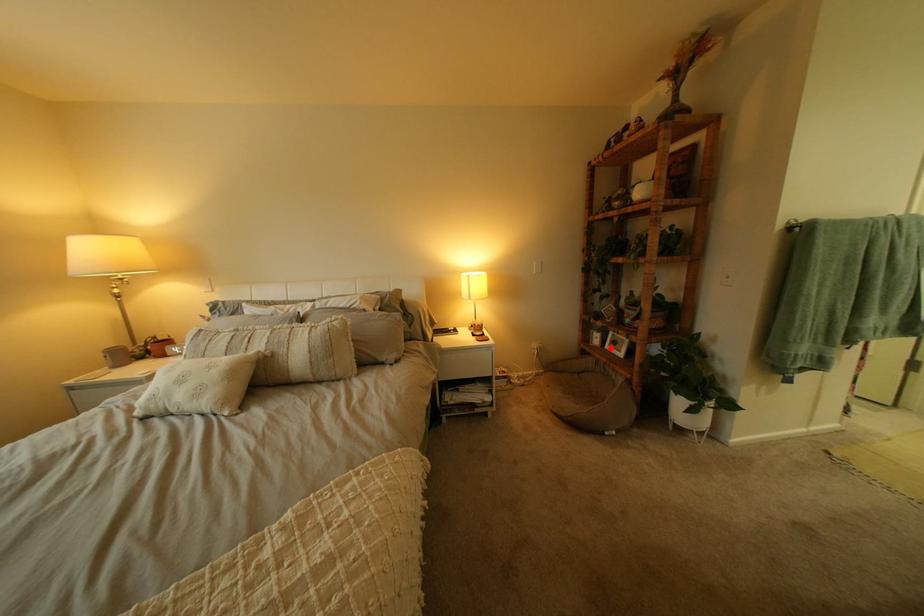
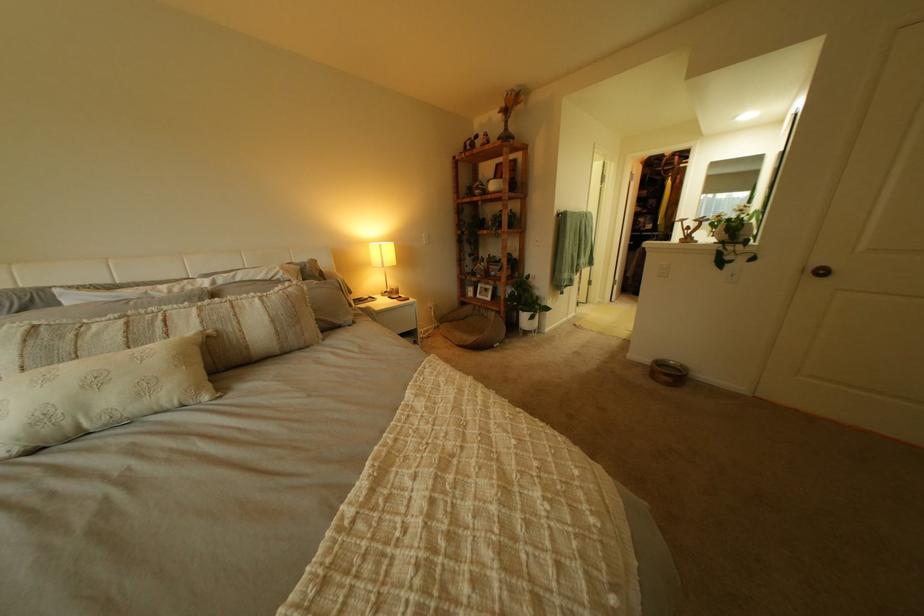
In the second image, find the point that corresponds to the highlighted location in the first image.

(485, 300)